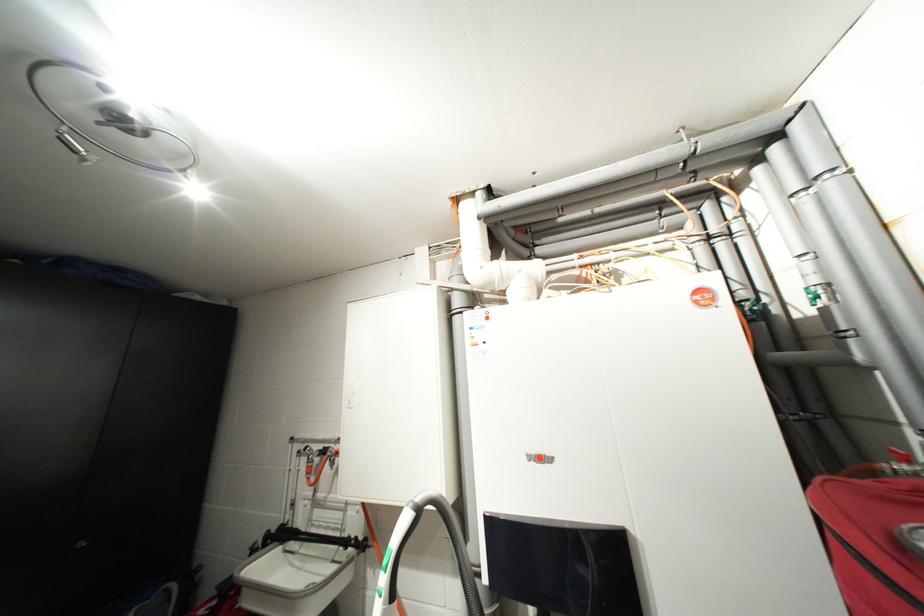
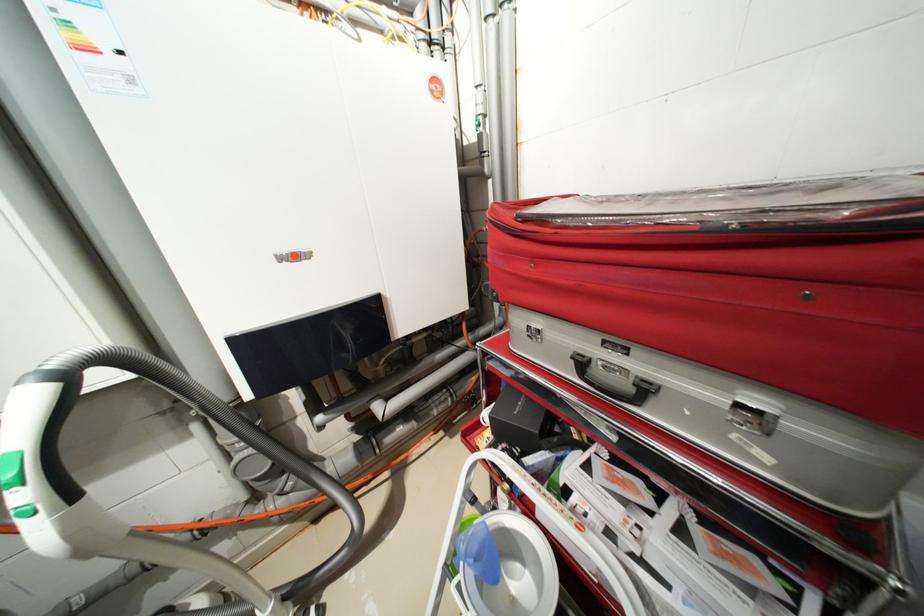
Locate, in the second image, the point that corresponds to the point at 418,506 in the first image.

(40, 379)